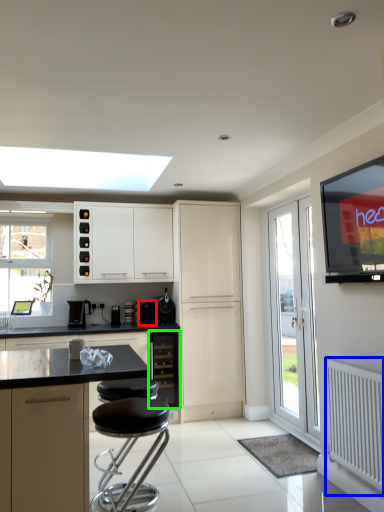
Question: Estimate the real-world distances between objects in this image. Which object is closer to appliance (highlighted by a red box), radiator (highlighted by a blue box) or cabinetry (highlighted by a green box)?

Choices:
 (A) radiator
 (B) cabinetry

Answer: (B)